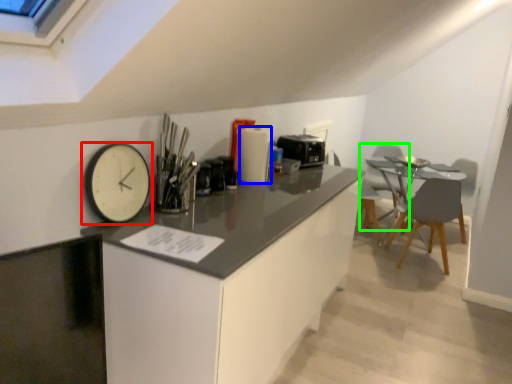
Question: Based on their relative distances, which object is nearer to wall clock (highlighted by a red box)? Choose from appliance (highlighted by a blue box) and swivel chair (highlighted by a green box).

Choices:
 (A) appliance
 (B) swivel chair

Answer: (A)